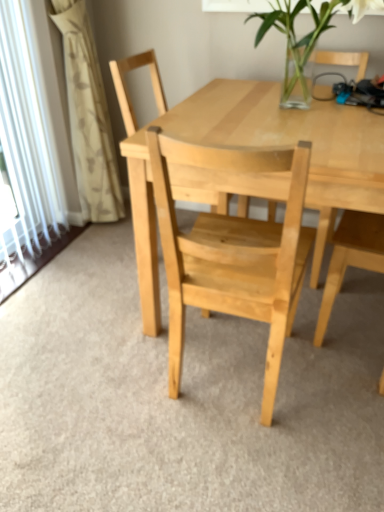
The width and height of the screenshot is (384, 512). Identify the location of free space underneath white textured curtain at left (from a real-world perspective). (97, 231).